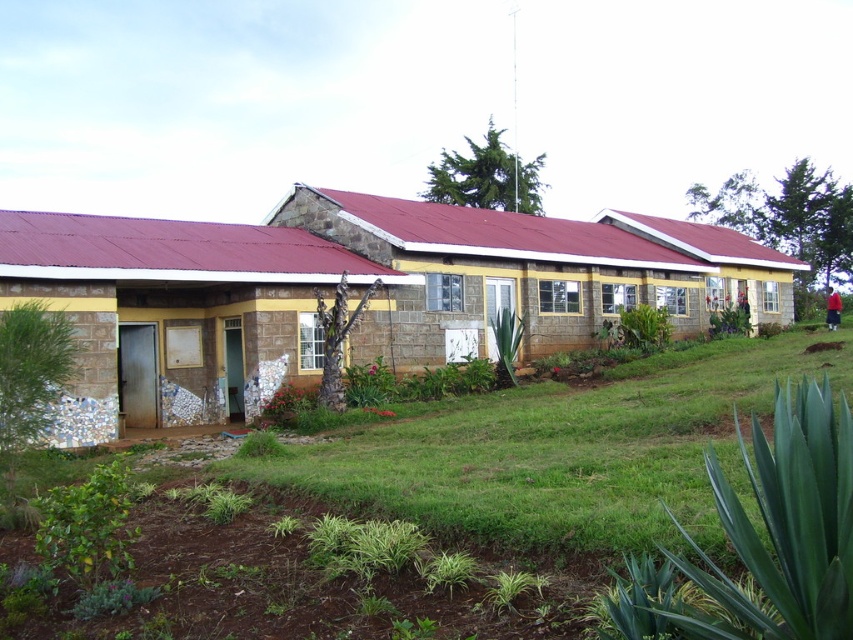
You are standing in front of the long, single story building with a red corrugated metal roof. You notice a point labeled as point [566,452]. What does this point represent?

The point [566,452] represents the location of green grass at lower center.

You are standing in front of the matte stone hut at left and the stone textured building at center. Which structure is closer to you?

The matte stone hut at left is closer to you because it is positioned in front of the stone textured building at center.

You are standing in front of the building and want to place a small decorative rock exactly at the center of the green grass at lower center. According to the coordinates provided, what are the coordinates where you should place the rock?

The coordinates for placing the decorative rock at the center of the green grass at lower center are exactly at point (x=566, y=452).